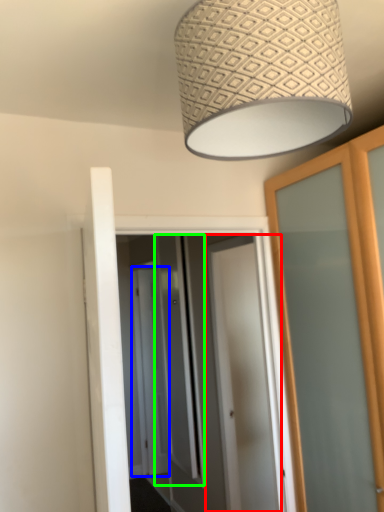
Question: Estimate the real-world distances between objects in this image. Which object is closer to door (highlighted by a red box), screen door (highlighted by a blue box) or screen door (highlighted by a green box)?

Choices:
 (A) screen door
 (B) screen door

Answer: (B)